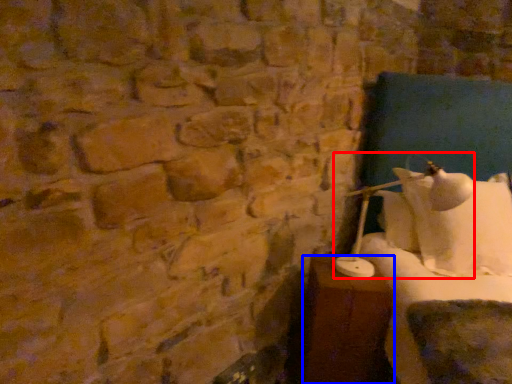
Question: Which point is further to the camera, table lamp (highlighted by a red box) or furniture (highlighted by a blue box)?

Choices:
 (A) table lamp
 (B) furniture

Answer: (B)